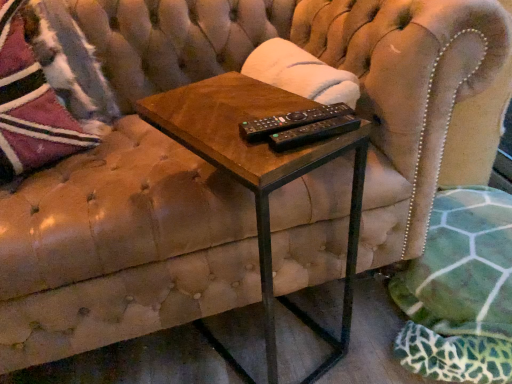
In order to click on empty space that is ontop of woodenmaterial/texturetable at center (from a real-world perspective) in this screenshot , I will do `click(243, 109)`.